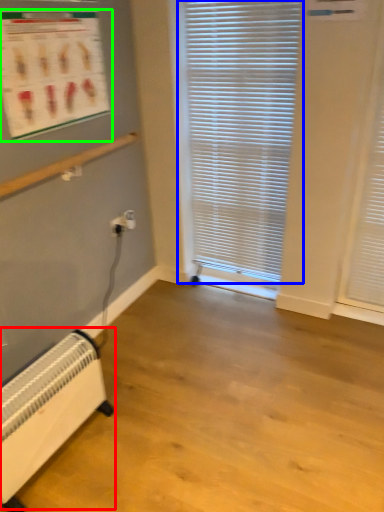
Question: Considering the real-world distances, which object is farthest from heater (highlighted by a red box)? window blind (highlighted by a blue box) or bulletin board (highlighted by a green box)?

Choices:
 (A) window blind
 (B) bulletin board

Answer: (A)